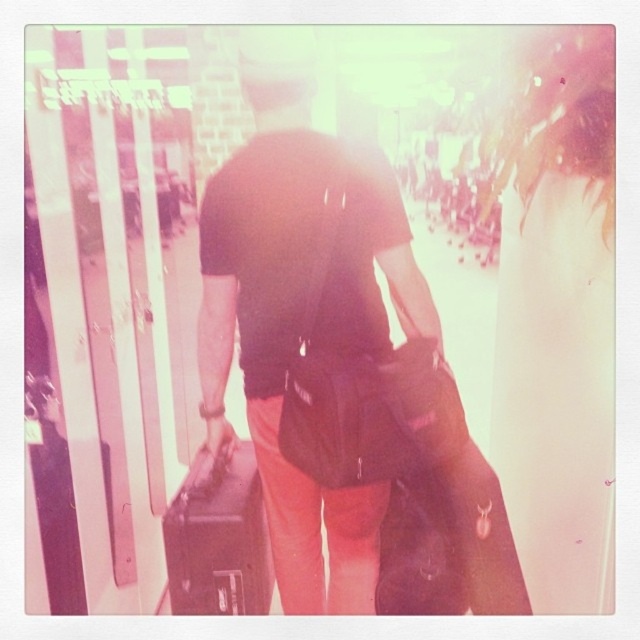
You are a traveler who needs to pack your luggage quickly. You see a matte black bag at center and a matte black suitcase at center. Which one is closer to you?

Both the matte black bag at center and matte black suitcase at center are 8.13 inches apart from each other, so they are equally close to you.

Consider the image. You are standing in a retro style station and see two points marked on the floor. The first point is at coordinate point (184,506) and the second point is at coordinate point (394,506). Which point is closer to you?

Point (184,506) is closer to you because it is further to the camera than point (394,506).

You are at an airport and need to check your luggage. The airline requires that the height of the luggage must not exceed 22 inches. You have a matte black bag at center and a matte black suitcase at center. Which one can you check in without exceeding the height limit?

The matte black suitcase at center can be checked in without exceeding the height limit because it has a smaller height compared to the matte black bag at center, which is taller and might exceed the airline requirement.